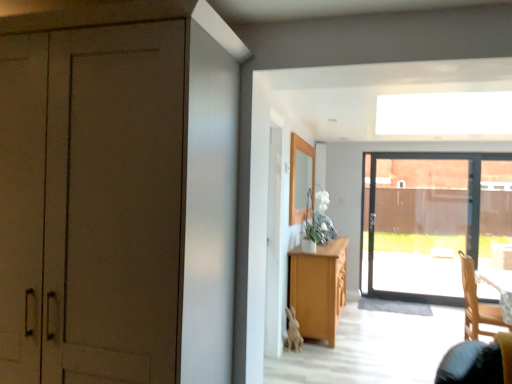
Question: From a real-world perspective, is matte brown cabinet at left located higher than light wood cabinet at center?

Choices:
 (A) yes
 (B) no

Answer: (A)

Question: Is matte brown cabinet at left closer to camera compared to light wood cabinet at center?

Choices:
 (A) yes
 (B) no

Answer: (A)

Question: From a real-world perspective, is matte brown cabinet at left beneath light wood cabinet at center?

Choices:
 (A) no
 (B) yes

Answer: (A)

Question: Can you confirm if matte brown cabinet at left is wider than light wood cabinet at center?

Choices:
 (A) no
 (B) yes

Answer: (B)

Question: Can we say matte brown cabinet at left lies outside light wood cabinet at center?

Choices:
 (A) no
 (B) yes

Answer: (B)

Question: Is wooden chair at lower right taller or shorter than matte brown cabinet at left?

Choices:
 (A) short
 (B) tall

Answer: (A)

Question: From a real-world perspective, is wooden chair at lower right positioned above or below matte brown cabinet at left?

Choices:
 (A) below
 (B) above

Answer: (A)

Question: From the image's perspective, relative to matte brown cabinet at left, is wooden chair at lower right above or below?

Choices:
 (A) below
 (B) above

Answer: (A)

Question: Is wooden chair at lower right inside or outside of matte brown cabinet at left?

Choices:
 (A) outside
 (B) inside

Answer: (A)

Question: Does point (311, 327) appear closer or farther from the camera than point (480, 321)?

Choices:
 (A) closer
 (B) farther

Answer: (B)

Question: From a real-world perspective, is light wood cabinet at center above or below wooden chair at lower right?

Choices:
 (A) below
 (B) above

Answer: (A)

Question: Considering their positions, is light wood cabinet at center located in front of or behind wooden chair at lower right?

Choices:
 (A) behind
 (B) front

Answer: (A)

Question: Looking at their shapes, would you say light wood cabinet at center is wider or thinner than wooden chair at lower right?

Choices:
 (A) thin
 (B) wide

Answer: (A)

Question: Is light wood cabinet at center inside the boundaries of matte brown cabinet at left, or outside?

Choices:
 (A) outside
 (B) inside

Answer: (A)

Question: Is point (292, 276) closer or farther from the camera than point (148, 218)?

Choices:
 (A) farther
 (B) closer

Answer: (A)